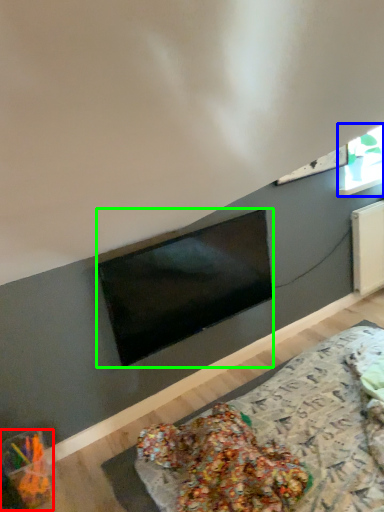
Question: Considering the real-world distances, which object is farthest from food (highlighted by a red box)? window (highlighted by a blue box) or television (highlighted by a green box)?

Choices:
 (A) window
 (B) television

Answer: (A)